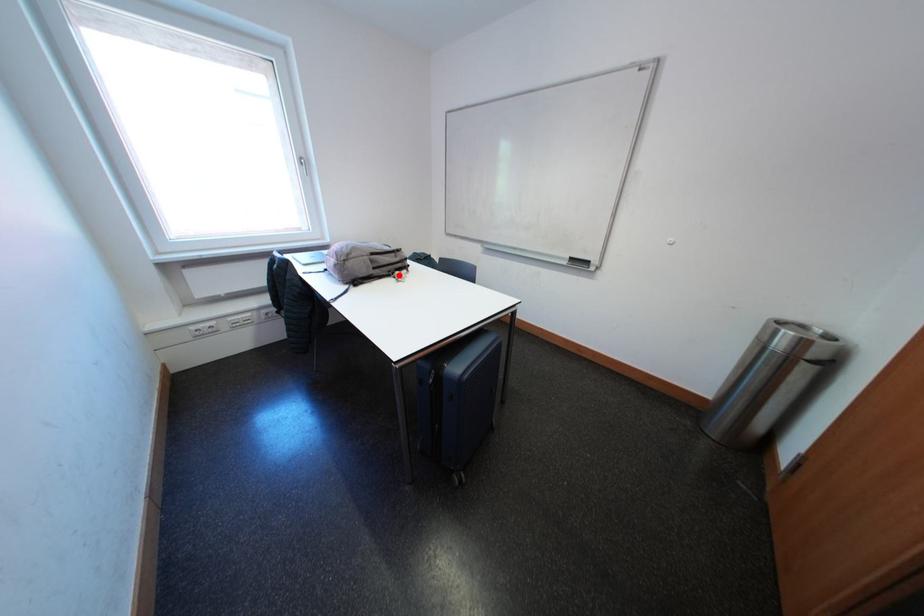
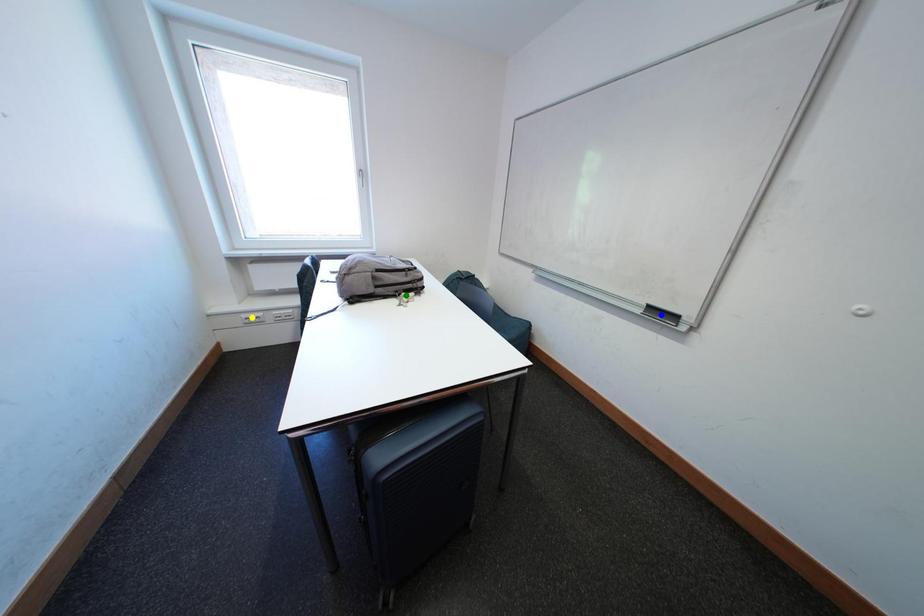
Question: I am providing you with two images of the same scene from different viewpoints. A red point is marked on the first image. You are given multiple points on the second image. In image 2, which mark is for the same physical point as the one in image 1?

Choices:
 (A) blue point
 (B) green point
 (C) yellow point

Answer: (B)